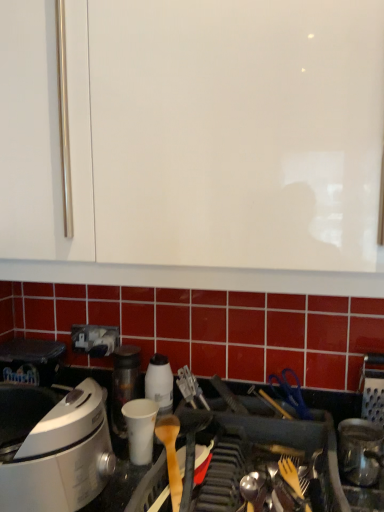
Question: Is white paper cup at center a part of shiny metallic canister at lower right, positioned as the second kitchen appliance in left-to-right order?

Choices:
 (A) yes
 (B) no

Answer: (B)

Question: From a real-world perspective, is shiny metallic canister at lower right, the 2th kitchen appliance when ordered from back to front, positioned under white paper cup at center based on gravity?

Choices:
 (A) yes
 (B) no

Answer: (A)

Question: Does shiny metallic canister at lower right, the first kitchen appliance in the front-to-back sequence, turn towards white paper cup at center?

Choices:
 (A) yes
 (B) no

Answer: (B)

Question: Considering the relative sizes of shiny metallic canister at lower right, positioned as the second kitchen appliance in left-to-right order, and white paper cup at center in the image provided, is shiny metallic canister at lower right, positioned as the second kitchen appliance in left-to-right order, wider than white paper cup at center?

Choices:
 (A) no
 (B) yes

Answer: (B)

Question: Does shiny metallic canister at lower right, positioned as the second kitchen appliance in left-to-right order, have a lesser height compared to white paper cup at center?

Choices:
 (A) no
 (B) yes

Answer: (A)

Question: From their relative heights in the image, would you say white paper cup at center is taller or shorter than white glossy container at center, which appears as the first kitchen appliance when viewed from the left?

Choices:
 (A) tall
 (B) short

Answer: (B)

Question: Is white paper cup at center in front of or behind white glossy container at center, which is counted as the first kitchen appliance, starting from the back, in the image?

Choices:
 (A) front
 (B) behind

Answer: (A)

Question: From the image's perspective, is white paper cup at center above or below white glossy container at center, which is counted as the first kitchen appliance, starting from the back?

Choices:
 (A) above
 (B) below

Answer: (B)

Question: Considering the positions of white paper cup at center and white glossy container at center, positioned as the second kitchen appliance in front-to-back order, in the image, is white paper cup at center wider or thinner than white glossy container at center, positioned as the second kitchen appliance in front-to-back order,?

Choices:
 (A) wide
 (B) thin

Answer: (A)

Question: Visually, is shiny metallic canister at lower right, the 1th kitchen appliance from the right, positioned to the left or to the right of white paper cup at center?

Choices:
 (A) right
 (B) left

Answer: (A)

Question: From the image's perspective, is shiny metallic canister at lower right, the first kitchen appliance in the front-to-back sequence, positioned above or below white paper cup at center?

Choices:
 (A) above
 (B) below

Answer: (B)

Question: Would you say shiny metallic canister at lower right, the first kitchen appliance in the front-to-back sequence, is inside or outside white paper cup at center?

Choices:
 (A) inside
 (B) outside

Answer: (B)

Question: In terms of width, does shiny metallic canister at lower right, the first kitchen appliance in the front-to-back sequence, look wider or thinner when compared to white paper cup at center?

Choices:
 (A) wide
 (B) thin

Answer: (A)

Question: Looking at their shapes, would you say shiny metallic canister at lower right, positioned as the second kitchen appliance in left-to-right order, is wider or thinner than white glossy container at center, which appears as the first kitchen appliance when viewed from the left?

Choices:
 (A) wide
 (B) thin

Answer: (A)

Question: Does point (344, 460) appear closer or farther from the camera than point (162, 359)?

Choices:
 (A) closer
 (B) farther

Answer: (A)